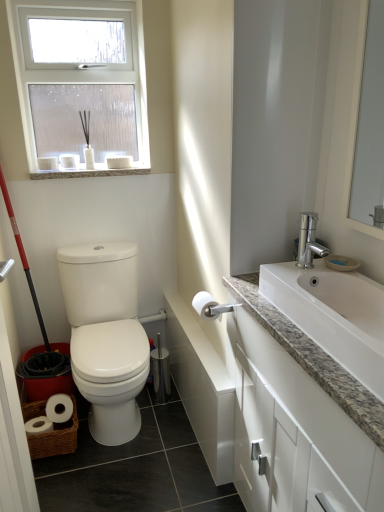
Locate an element on the screen. The height and width of the screenshot is (512, 384). free space above granite at upper left (from a real-world perspective) is located at coordinates (79, 169).